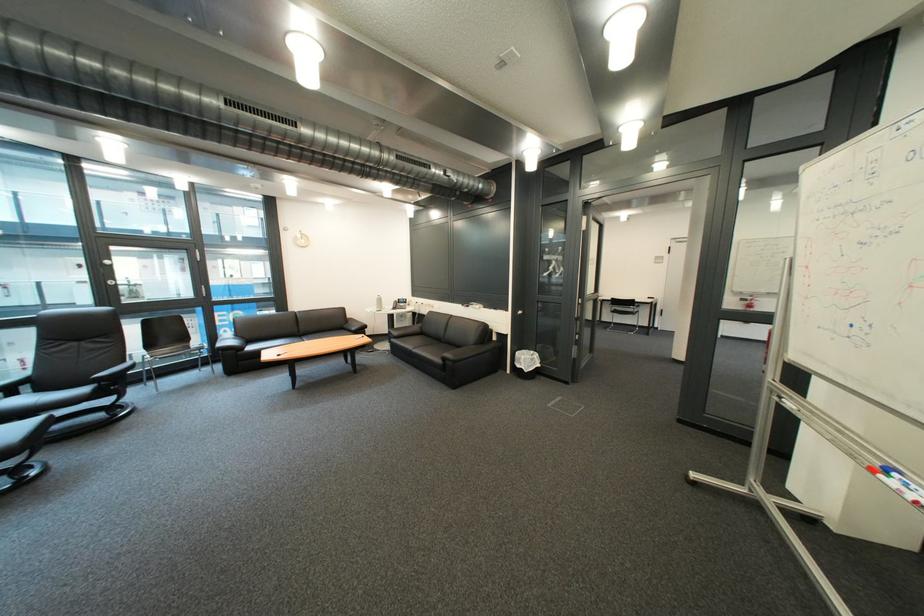
Locate an element on the screen. blue whiteboard marker is located at coordinates (900, 475).